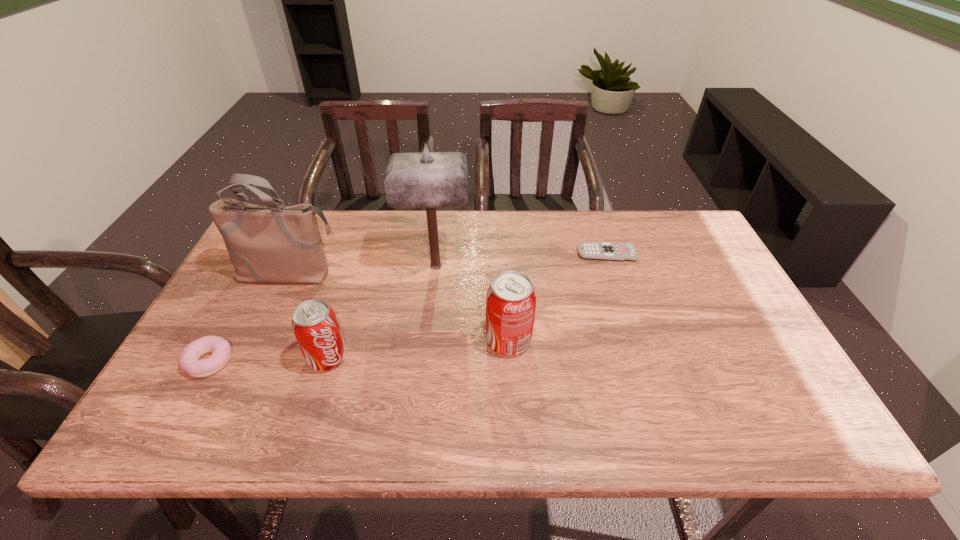
You are a GUI agent. You are given a task and a screenshot of the screen. Output one action in this format:
    pyautogui.click(x=<x>, y=<y>)
    Task: Click on the doughnut present at the left edge
    This screenshot has height=540, width=960.
    Given the screenshot: What is the action you would take?
    pyautogui.click(x=189, y=360)

You are a GUI agent. You are given a task and a screenshot of the screen. Output one action in this format:
    pyautogui.click(x=<x>, y=<y>)
    Task: Click on the object at the near left corner
    
    Given the screenshot: What is the action you would take?
    pyautogui.click(x=189, y=360)

Image resolution: width=960 pixels, height=540 pixels. I want to click on vacant space at the far edge, so click(x=468, y=226).

Find the location of a particular element. blank space at the near edge is located at coordinates (633, 385).

I want to click on blank area at the left edge, so click(212, 319).

Locate an element on the screen. The height and width of the screenshot is (540, 960). vacant space at the right edge of the desktop is located at coordinates point(766,357).

At what (x,y) coordinates should I click in order to perform the action: click on free spot at the far right corner of the desktop. Please return your answer as a coordinate pair (x, y). The height and width of the screenshot is (540, 960). Looking at the image, I should click on (708, 248).

This screenshot has width=960, height=540. What are the coordinates of `vacant space at the near right corner of the desktop` in the screenshot? It's located at [763, 375].

This screenshot has width=960, height=540. I want to click on vacant area that lies between the shoulder bag and the mallet, so click(x=363, y=270).

Locate an element on the screen. vacant area that lies between the second tallest object and the shortest object is located at coordinates (448, 264).